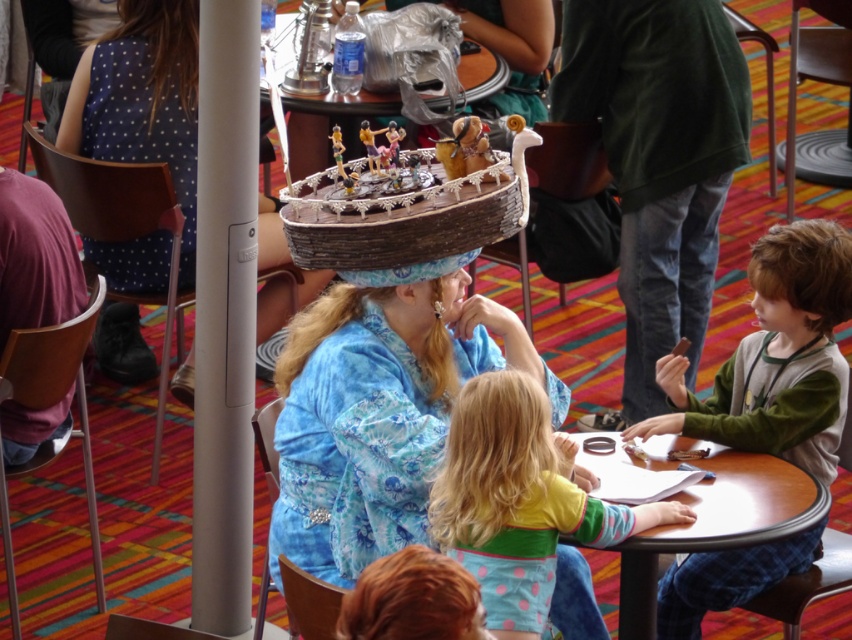
Does wooden boat at center have a lesser height compared to smooth wooden table at center?

Yes, wooden boat at center is shorter than smooth wooden table at center.

Is point (349, 262) in front of point (671, 541)?

No, (349, 262) is behind (671, 541).

Where is `wooden boat at center`? wooden boat at center is located at coordinates (401, 218).

Is green fleece shirt at lower right thinner than smooth wooden table at center?

Indeed, green fleece shirt at lower right has a lesser width compared to smooth wooden table at center.

Who is shorter, green fleece shirt at lower right or smooth wooden table at center?

Standing shorter between the two is smooth wooden table at center.

Who is more forward, (x=809, y=333) or (x=634, y=577)?

Point (x=634, y=577) is in front.

Locate an element on the screen. green fleece shirt at lower right is located at coordinates tap(776, 356).

Is green fleece shirt at lower right to the right of blue fabric hat at center from the viewer's perspective?

Correct, you'll find green fleece shirt at lower right to the right of blue fabric hat at center.

Is point (726, 380) less distant than point (180, 88)?

Yes, it is.

Does point (735, 410) come closer to viewer compared to point (193, 58)?

Yes.

Identify the location of green fleece shirt at lower right. (776, 356).